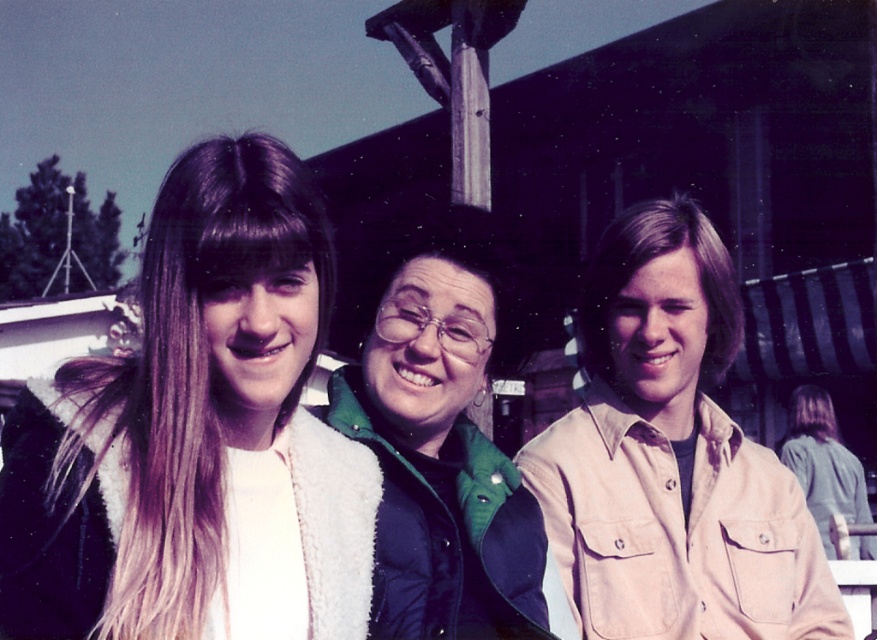
You are taking a photo of the beige cotton shirt at center. To ensure it is in focus, where should you aim the camera?

The beige cotton shirt at center is located at point (672, 458), so aim the camera at those coordinates to ensure it is in focus.

You are a photographer trying to capture a group photo of the three people. You want to ensure that the white fleece jacket at left and the green fuzzy vest at center are both visible in the frame. Based on their positions, which direction should you position the camera relative to the group?

The white fleece jacket at left is to the left of the green fuzzy vest at center, so positioning the camera to the right of the group will ensure both the white fleece jacket at left and the green fuzzy vest at center are visible in the frame.

You are standing in the rustic outdoor setting and want to hand a small gift to the person wearing the beige cotton shirt at center without moving closer than 8 feet. Is the distance sufficient?

The beige cotton shirt at center is 9.26 feet away from the viewer. Since you need to stay at least 8 feet away, the distance is insufficient as it exceeds the maximum allowed distance.